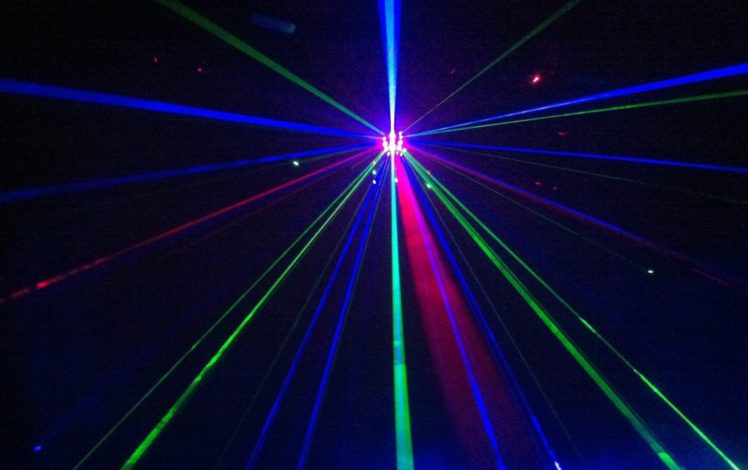
This screenshot has width=748, height=470. I want to click on light, so click(x=389, y=153).